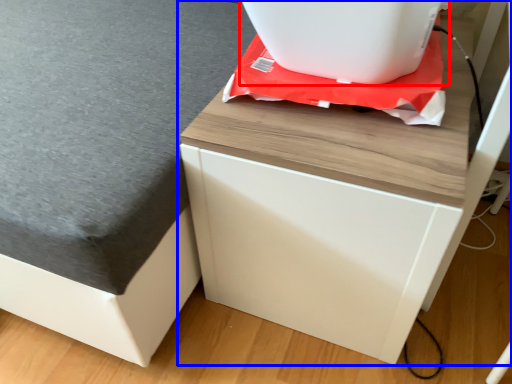
Question: Which point is closer to the camera, appliance (highlighted by a red box) or furniture (highlighted by a blue box)?

Choices:
 (A) appliance
 (B) furniture

Answer: (B)